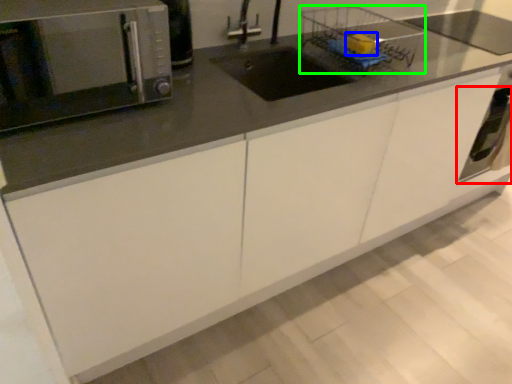
Question: Which is nearer to the oven (highlighted by a red box)? food (highlighted by a blue box) or basket (highlighted by a green box).

Choices:
 (A) food
 (B) basket

Answer: (B)